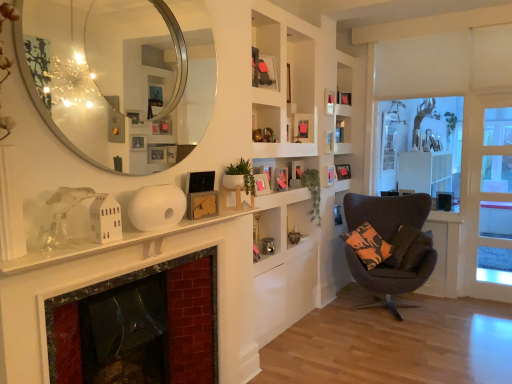
Question: From a real-world perspective, is white matte fireplace mantle at center physically above wooden picture frame at upper center, which appears as the sixth picture frame when viewed from the back?

Choices:
 (A) yes
 (B) no

Answer: (B)

Question: Is white matte fireplace mantle at center oriented away from wooden picture frame at upper center, the 4th picture frame viewed from the front?

Choices:
 (A) no
 (B) yes

Answer: (A)

Question: Considering the relative sizes of white matte fireplace mantle at center and wooden picture frame at upper center, acting as the sixth picture frame starting from the right, in the image provided, is white matte fireplace mantle at center taller than wooden picture frame at upper center, acting as the sixth picture frame starting from the right,?

Choices:
 (A) no
 (B) yes

Answer: (A)

Question: Does white matte fireplace mantle at center have a larger size compared to wooden picture frame at upper center, acting as the sixth picture frame starting from the right?

Choices:
 (A) yes
 (B) no

Answer: (A)

Question: Does white matte fireplace mantle at center contain wooden picture frame at upper center, the fourth picture frame viewed from the left?

Choices:
 (A) no
 (B) yes

Answer: (A)

Question: Based on their positions, is smooth black glass fireplace at lower left located to the left or right of wooden picture frame at upper center, acting as the sixth picture frame starting from the right?

Choices:
 (A) right
 (B) left

Answer: (B)

Question: From the image's perspective, relative to wooden picture frame at upper center, the fourth picture frame viewed from the left, is smooth black glass fireplace at lower left above or below?

Choices:
 (A) below
 (B) above

Answer: (A)

Question: Is point (56, 299) closer or farther from the camera than point (296, 117)?

Choices:
 (A) closer
 (B) farther

Answer: (A)

Question: Based on their sizes in the image, would you say smooth black glass fireplace at lower left is bigger or smaller than wooden picture frame at upper center, which appears as the sixth picture frame when viewed from the back?

Choices:
 (A) big
 (B) small

Answer: (A)

Question: From a real-world perspective, relative to white wood window frame at right, is wooden picture frame at upper center, the 7th picture frame positioned from the left, vertically above or below?

Choices:
 (A) below
 (B) above

Answer: (A)

Question: Would you say wooden picture frame at upper center, the 7th picture frame positioned from the left, is to the left or to the right of white wood window frame at right in the picture?

Choices:
 (A) right
 (B) left

Answer: (B)

Question: Is wooden picture frame at upper center, the 7th picture frame positioned from the left, in front of or behind white wood window frame at right in the image?

Choices:
 (A) behind
 (B) front

Answer: (A)

Question: Choose the correct answer: Is wooden picture frame at upper center, the 3th picture frame viewed from the back, inside white wood window frame at right or outside it?

Choices:
 (A) outside
 (B) inside

Answer: (A)

Question: Considering their positions, is wooden picture frame at upper center, arranged as the fourth picture frame when viewed from the right, located in front of or behind wooden picture frame at upper center, which appears as the sixth picture frame when viewed from the back?

Choices:
 (A) front
 (B) behind

Answer: (B)

Question: From the image's perspective, is wooden picture frame at upper center, the 5th picture frame viewed from the back, above or below wooden picture frame at upper center, acting as the sixth picture frame starting from the right?

Choices:
 (A) above
 (B) below

Answer: (A)